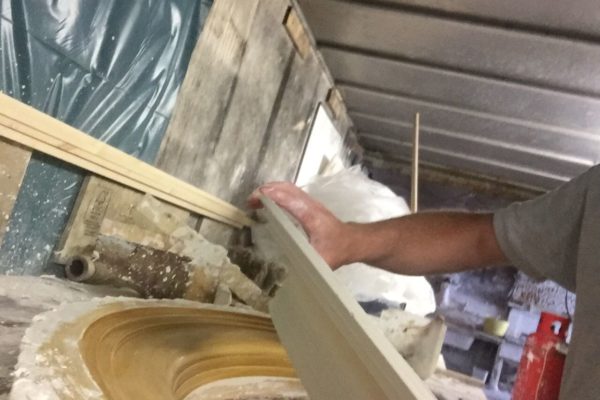
At what (x,y) coordinates should I click in order to perform the action: click on wood panels. Please return your answer as a coordinate pair (x, y). The image size is (600, 400). Looking at the image, I should click on (218, 90), (250, 112), (275, 120).